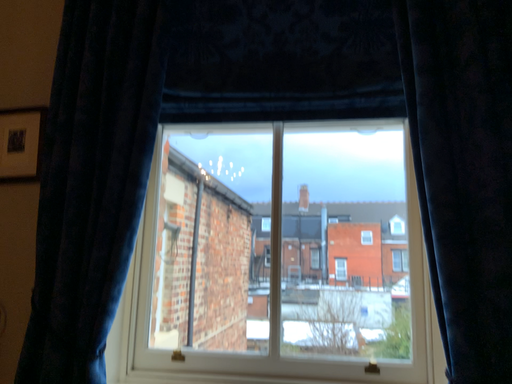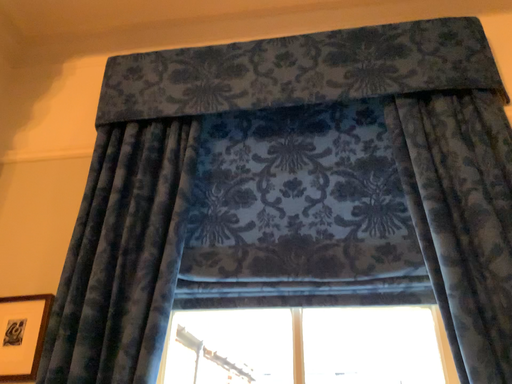
Question: How did the camera likely rotate when shooting the video?

Choices:
 (A) rotated upward
 (B) rotated downward

Answer: (A)